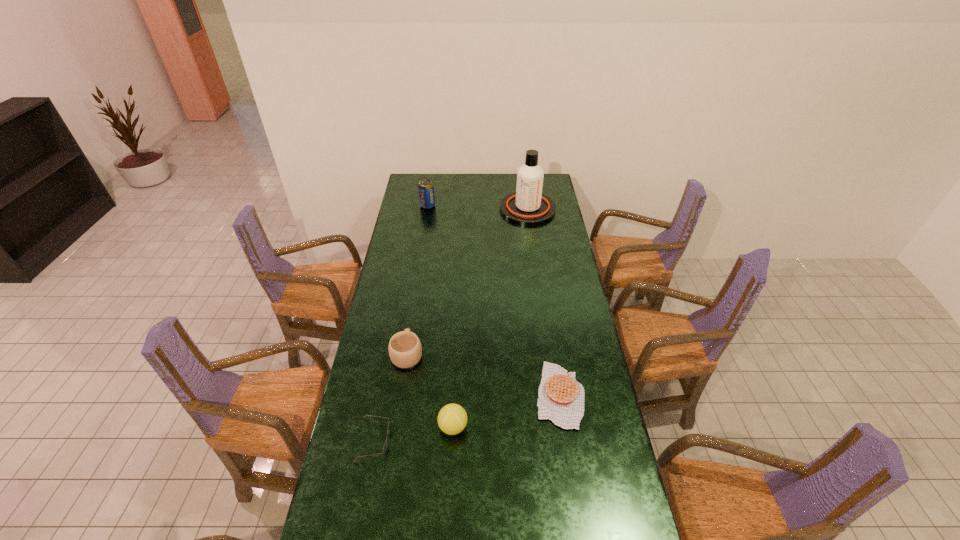
Find the location of a particular element. The image size is (960, 540). vacant area between the sunglasses and the mug is located at coordinates tap(391, 397).

Identify the location of unoccupied position between the soda and the pie. The height and width of the screenshot is (540, 960). (493, 300).

In order to click on vacant space that's between the mug and the pie in this screenshot , I will do `click(484, 374)`.

Where is `free space between the cleansing agent and the mug`? The width and height of the screenshot is (960, 540). free space between the cleansing agent and the mug is located at coordinates click(x=468, y=282).

The width and height of the screenshot is (960, 540). In order to click on vacant space that is in between the mug and the sunglasses in this screenshot , I will do `click(391, 397)`.

You are a GUI agent. You are given a task and a screenshot of the screen. Output one action in this format:
    pyautogui.click(x=<x>, y=<y>)
    Task: Click on the object that is the second closest to the tallest object
    The image size is (960, 540).
    Given the screenshot: What is the action you would take?
    pyautogui.click(x=405, y=351)

Identify which object is the fifth closest to the cleansing agent. Please provide its 2D coordinates. Your answer should be formatted as a tuple, i.e. [(x, y)], where the tuple contains the x and y coordinates of a point satisfying the conditions above.

[(386, 441)]

Find the location of a particular element. This screenshot has height=540, width=960. blank space that satisfies the following two spatial constraints: 1. on the back side of the tallest object; 2. on the left side of the third object from right to left is located at coordinates (464, 210).

Find the location of a particular element. Image resolution: width=960 pixels, height=540 pixels. vacant region that satisfies the following two spatial constraints: 1. on the side of the mug with the handle; 2. on the left side of the cleansing agent is located at coordinates (429, 210).

I want to click on blank area in the image that satisfies the following two spatial constraints: 1. on the side of the mug with the handle; 2. on the left side of the tallest object, so click(429, 210).